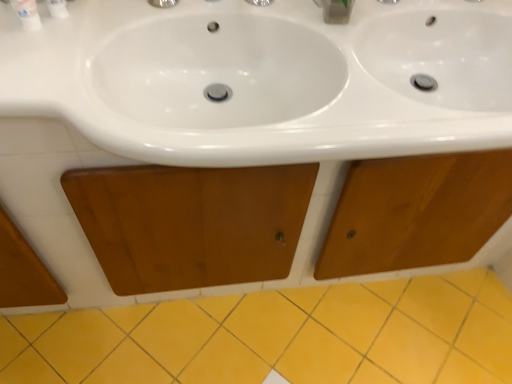
Identify the location of free space in front of clear plastic container at upper center. (347, 69).